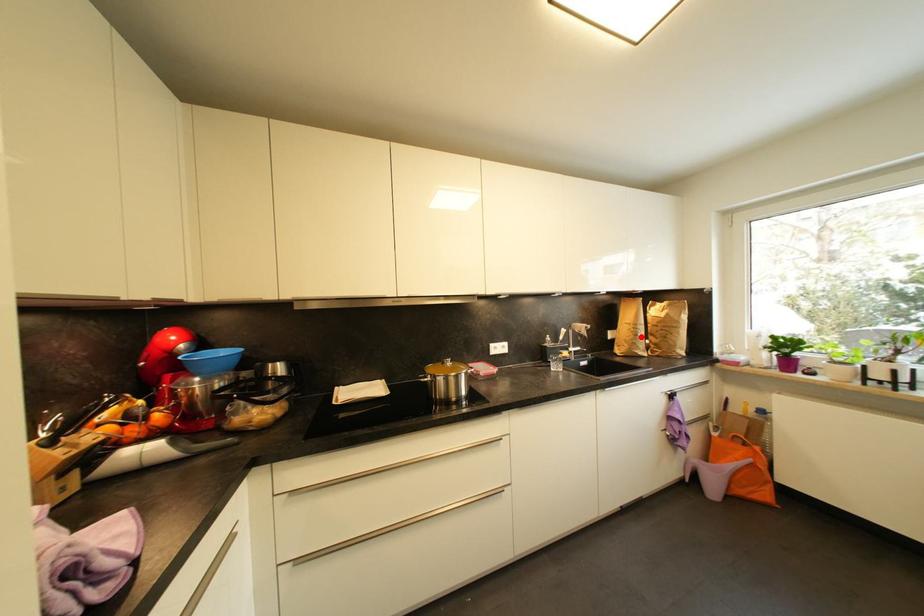
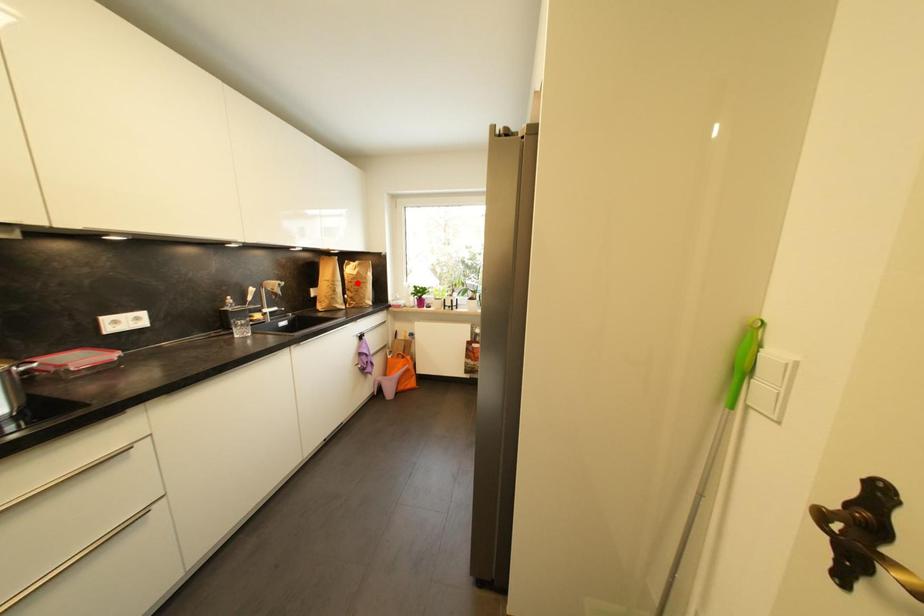
I am providing you with two images of the same scene from different viewpoints. A red point is marked on the first image and another point is marked on the second image. Is the red point in image1 aligned with the point shown in image2?

No